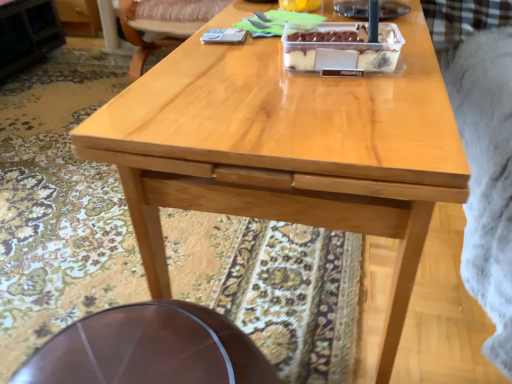
I want to click on blank space above shiny brown table at lower center (from a real-world perspective), so click(x=155, y=342).